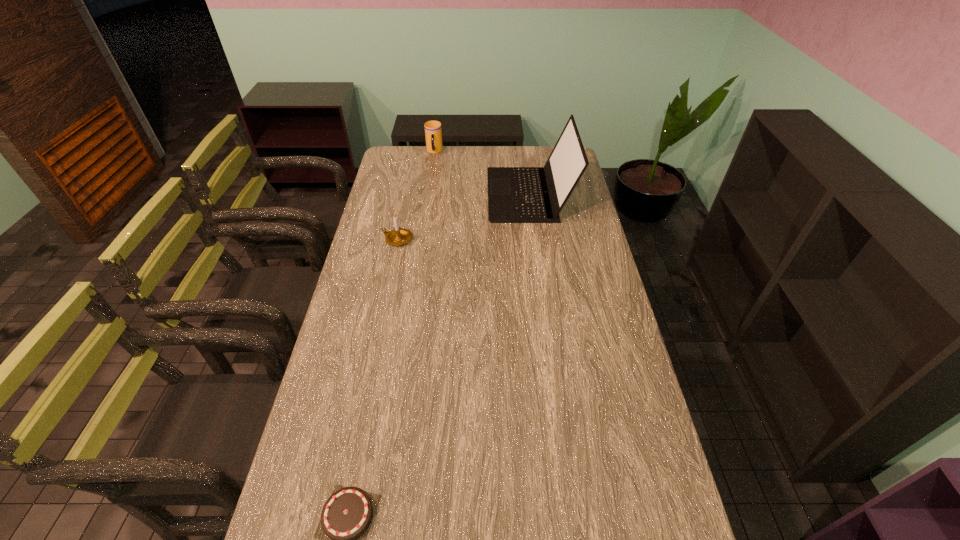
Locate an element on the screen. This screenshot has height=540, width=960. the tallest object is located at coordinates (515, 194).

At what (x,y) coordinates should I click in order to perform the action: click on laptop. Please return your answer as a coordinate pair (x, y). Looking at the image, I should click on (515, 194).

Locate an element on the screen. The width and height of the screenshot is (960, 540). the farthest object is located at coordinates (433, 132).

Where is `candle holder`? The image size is (960, 540). candle holder is located at coordinates (398, 236).

You are a GUI agent. You are given a task and a screenshot of the screen. Output one action in this format:
    pyautogui.click(x=<x>, y=<y>)
    Task: Click on the free region located on the surface of the rightmost object
    The width and height of the screenshot is (960, 540).
    Given the screenshot: What is the action you would take?
    [x=437, y=195]

At what (x,y) coordinates should I click in order to perform the action: click on vacant space situated 0.340m on the surface of the rightmost object. Please return your answer as a coordinate pair (x, y). The width and height of the screenshot is (960, 540). Looking at the image, I should click on (409, 195).

I want to click on vacant space positioned on the surface of the rightmost object, so tap(396, 195).

Identify the location of blank space located on the side of the farthest object with the handle. The width and height of the screenshot is (960, 540). (428, 196).

This screenshot has width=960, height=540. Find the location of `vacant region located 0.290m on the right of the second nearest object`. vacant region located 0.290m on the right of the second nearest object is located at coordinates (489, 239).

What are the coordinates of `laptop that is at the far edge` in the screenshot? It's located at (x=515, y=194).